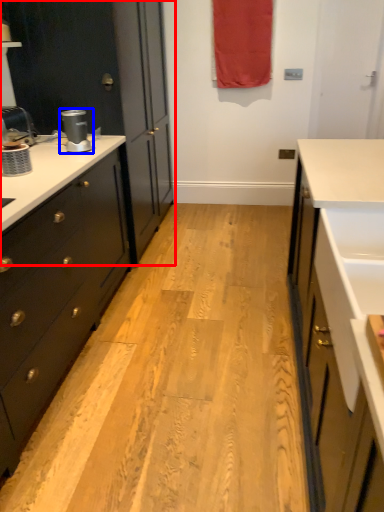
Question: Among these objects, which one is farthest to the camera, cabinetry (highlighted by a red box) or coffee machine (highlighted by a blue box)?

Choices:
 (A) cabinetry
 (B) coffee machine

Answer: (A)